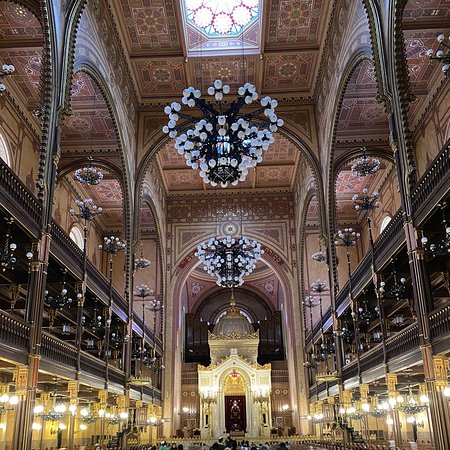
At what (x,y) coordinates should I click in order to perform the action: click on ceiling. Please return your answer as a coordinate pair (x, y). Looking at the image, I should click on (305, 76).